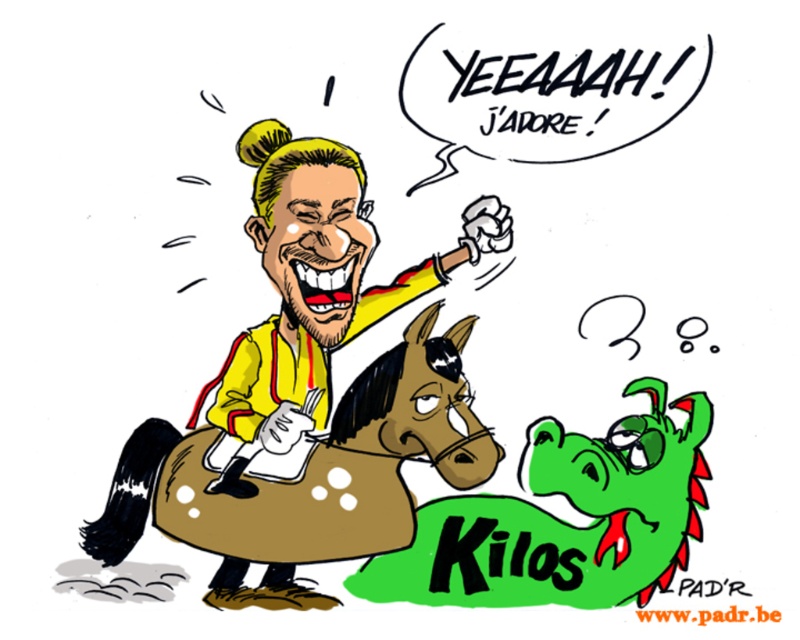
Is brown leather horse at center shorter than yellow matte jacket at center?

Yes, brown leather horse at center is shorter than yellow matte jacket at center.

Is brown leather horse at center taller than yellow matte jacket at center?

In fact, brown leather horse at center may be shorter than yellow matte jacket at center.

You are a GUI agent. You are given a task and a screenshot of the screen. Output one action in this format:
    pyautogui.click(x=<x>, y=<y>)
    Task: Click on the brown leather horse at center
    The height and width of the screenshot is (640, 800).
    Given the screenshot: What is the action you would take?
    pyautogui.click(x=308, y=477)

Where is `brown leather horse at center`? This screenshot has height=640, width=800. brown leather horse at center is located at coordinates (308, 477).